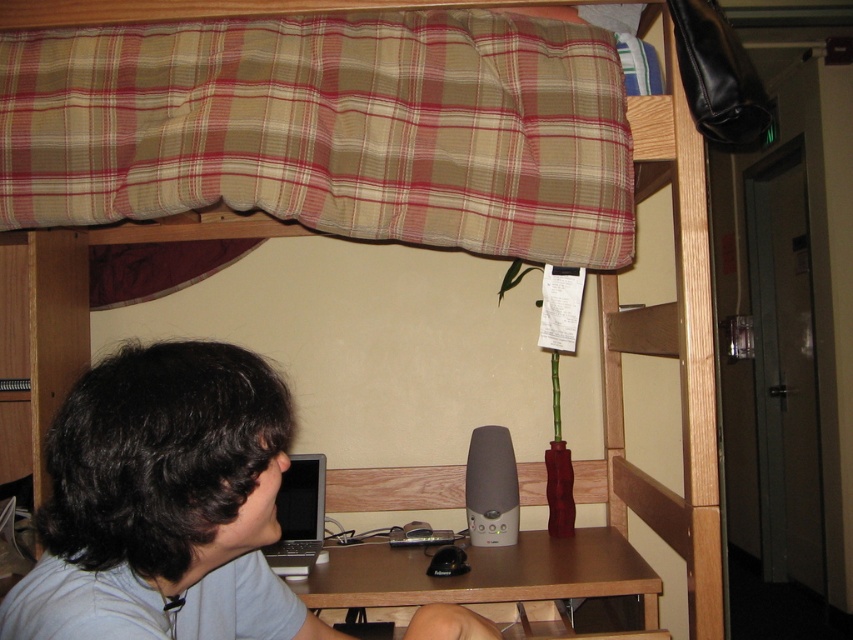
Between plaid fabric curtain at upper center and brown wooden table at lower center, which one appears on the left side from the viewer's perspective?

plaid fabric curtain at upper center is more to the left.

Does point (65, 193) come in front of point (386, 566)?

Yes, it is in front of point (386, 566).

What are the coordinates of `plaid fabric curtain at upper center` in the screenshot? It's located at (329, 129).

Between point (74, 456) and point (421, 564), which one is positioned in front?

Positioned in front is point (74, 456).

Is light blue cotton shirt at center closer to camera compared to brown wooden table at lower center?

Yes, it is.

Between point (245, 499) and point (352, 556), which one is positioned behind?

Point (352, 556)

Find the location of a particular element. The width and height of the screenshot is (853, 640). light blue cotton shirt at center is located at coordinates (164, 502).

Which is in front, point (306, 209) or point (293, 512)?

Point (306, 209) is more forward.

Can you confirm if plaid fabric curtain at upper center is bigger than silver metallic laptop at lower center?

Indeed, plaid fabric curtain at upper center has a larger size compared to silver metallic laptop at lower center.

This screenshot has width=853, height=640. What do you see at coordinates (329, 129) in the screenshot?
I see `plaid fabric curtain at upper center` at bounding box center [329, 129].

Find the location of a particular element. The width and height of the screenshot is (853, 640). plaid fabric curtain at upper center is located at coordinates (329, 129).